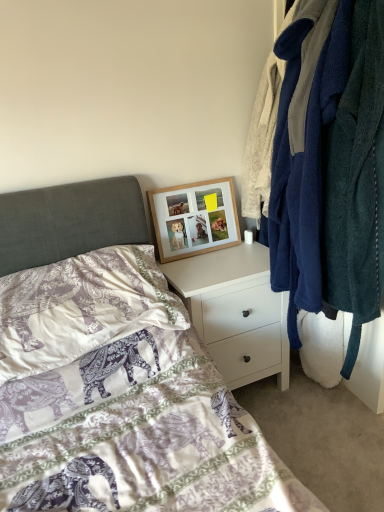
Question: Considering the relative positions of white matte nightstand at upper center and purple elephant-patterned pillow at lower left in the image provided, is white matte nightstand at upper center to the right of purple elephant-patterned pillow at lower left from the viewer's perspective?

Choices:
 (A) yes
 (B) no

Answer: (A)

Question: From the image's perspective, is white matte nightstand at upper center located above purple elephant-patterned pillow at lower left?

Choices:
 (A) no
 (B) yes

Answer: (A)

Question: Is purple elephant-patterned pillow at lower left a part of white matte nightstand at upper center?

Choices:
 (A) yes
 (B) no

Answer: (B)

Question: Is white matte nightstand at upper center far from purple elephant-patterned pillow at lower left?

Choices:
 (A) no
 (B) yes

Answer: (A)

Question: From a real-world perspective, is white matte nightstand at upper center positioned over purple elephant-patterned pillow at lower left based on gravity?

Choices:
 (A) yes
 (B) no

Answer: (B)

Question: In terms of width, does soft fleece robes at right look wider or thinner when compared to purple elephant-patterned pillow at lower left?

Choices:
 (A) thin
 (B) wide

Answer: (A)

Question: Is point (299, 110) closer or farther from the camera than point (26, 369)?

Choices:
 (A) closer
 (B) farther

Answer: (B)

Question: Is soft fleece robes at right spatially inside purple elephant-patterned pillow at lower left, or outside of it?

Choices:
 (A) inside
 (B) outside

Answer: (B)

Question: From a real-world perspective, is soft fleece robes at right positioned above or below purple elephant-patterned pillow at lower left?

Choices:
 (A) below
 (B) above

Answer: (B)

Question: From a real-world perspective, is white matte nightstand at upper center above or below woodenobject at upper center?

Choices:
 (A) below
 (B) above

Answer: (A)

Question: Looking at their shapes, would you say white matte nightstand at upper center is wider or thinner than woodenobject at upper center?

Choices:
 (A) thin
 (B) wide

Answer: (B)

Question: Which is correct: white matte nightstand at upper center is inside woodenobject at upper center, or outside of it?

Choices:
 (A) inside
 (B) outside

Answer: (B)

Question: In terms of height, does white matte nightstand at upper center look taller or shorter compared to woodenobject at upper center?

Choices:
 (A) tall
 (B) short

Answer: (A)

Question: Considering the positions of soft fleece robes at right and woodenobject at upper center in the image, is soft fleece robes at right wider or thinner than woodenobject at upper center?

Choices:
 (A) wide
 (B) thin

Answer: (A)

Question: Based on their sizes in the image, would you say soft fleece robes at right is bigger or smaller than woodenobject at upper center?

Choices:
 (A) small
 (B) big

Answer: (B)